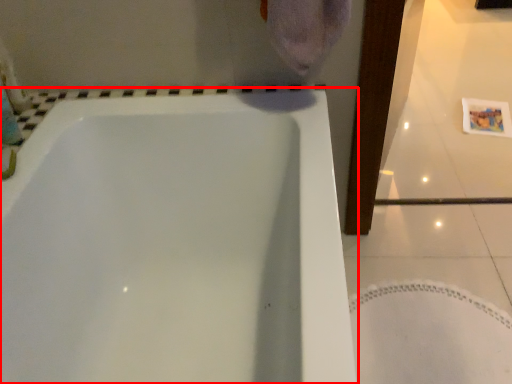
Question: From the image's perspective, what is the correct spatial positioning of bathtub (annotated by the red box) in reference to bath mat?

Choices:
 (A) above
 (B) below

Answer: (A)